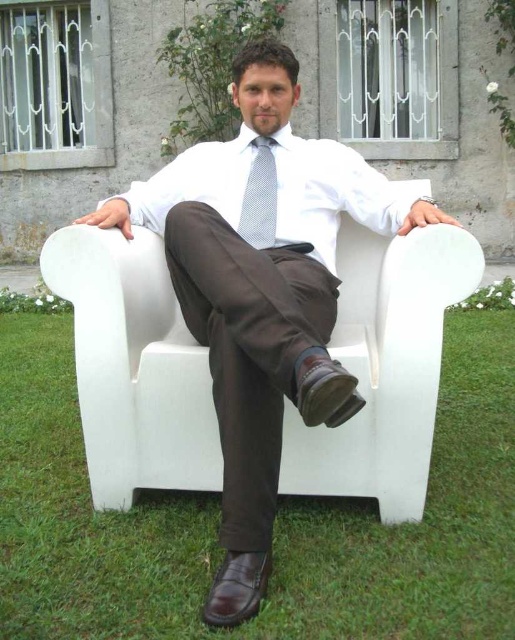
You are a photographer taking a portrait of the man in the image. You want to ensure that both the matte white suit at center and the white smooth dress shirt at center are clearly visible in the photo. Based on their positions, which one should you focus on first to ensure proper exposure?

The matte white suit at center is below the white smooth dress shirt at center. Since the dress shirt is higher up, focusing on it first might help balance the exposure for both elements in the scene.

You are a fashion designer observing the man in the image. You need to determine if the white smooth dress shirt at center can be folded and placed inside the white dotted fabric tie at center. Based on their sizes, is this possible?

The white smooth dress shirt at center might be wider than white dotted fabric tie at center, so it is unlikely that the shirt can be folded and placed inside the tie as the shirt is probably larger in size.